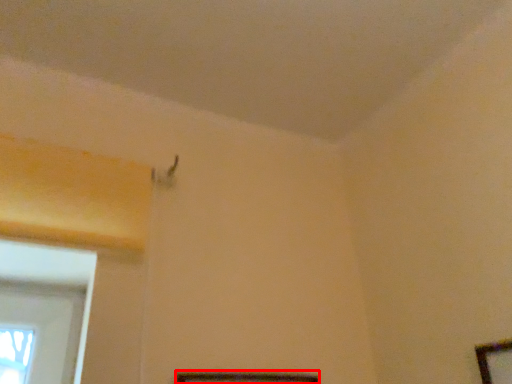
Question: In this image, where is picture frame (annotated by the red box) located relative to picture frame?

Choices:
 (A) right
 (B) left

Answer: (B)